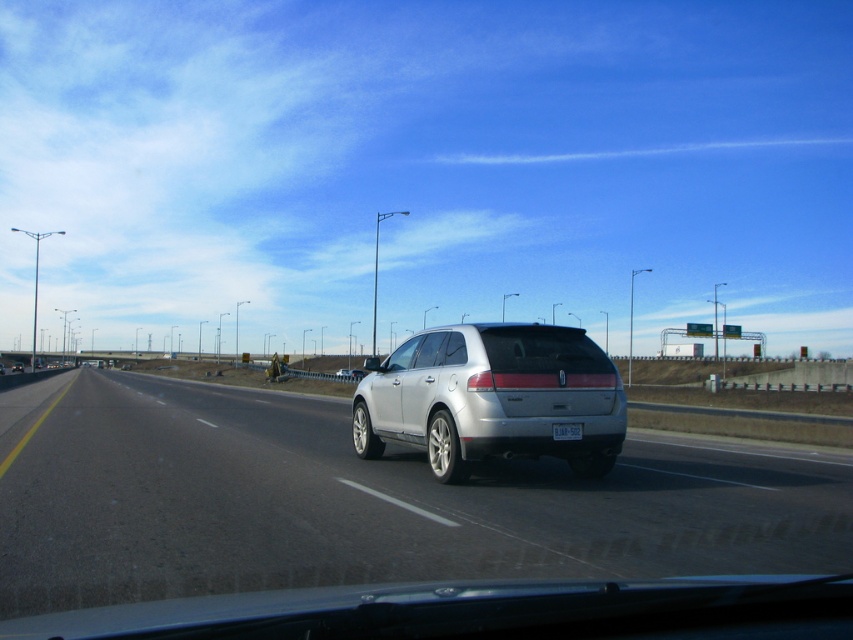
Does point (236, 452) come farther from viewer compared to point (581, 435)?

Yes, it is.

The image size is (853, 640). Identify the location of silver metallic suv at center. (372, 504).

Is silver metallic suv at center to the left of satin silver suv at center from the viewer's perspective?

Indeed, silver metallic suv at center is positioned on the left side of satin silver suv at center.

Is silver metallic suv at center positioned behind satin silver suv at center?

No, silver metallic suv at center is closer to the viewer.

Is point (718, 500) less distant than point (367, 449)?

That is True.

Where is `silver metallic suv at center`? This screenshot has height=640, width=853. silver metallic suv at center is located at coordinates (372, 504).

The height and width of the screenshot is (640, 853). What do you see at coordinates (492, 397) in the screenshot? I see `satin silver suv at center` at bounding box center [492, 397].

Describe the element at coordinates (492, 397) in the screenshot. I see `satin silver suv at center` at that location.

You are a GUI agent. You are given a task and a screenshot of the screen. Output one action in this format:
    pyautogui.click(x=<x>, y=<y>)
    Task: Click on the satin silver suv at center
    The height and width of the screenshot is (640, 853).
    Given the screenshot: What is the action you would take?
    pyautogui.click(x=492, y=397)